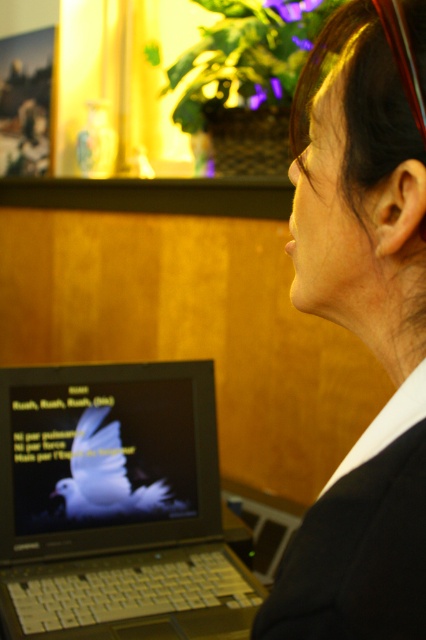
You are a tailor who needs to place a white matte bird at center onto the black fabric business suit at lower right. Given the distance between them is 29.07 inches, can you determine if the bird will fit on the suit without overlapping?

The white matte bird at center and black fabric business suit at lower right are 29.07 inches apart. Since the distance between them is greater than the bird and suit dimensions, the bird can be placed on the suit without overlapping.

You are a delivery person who needs to place a small package on the desk in the image. The package must be placed exactly at the point labeled point (316, 288). However, you can only place it within 18.29 inches of the edge of the desk. Can you place the package at the specified point?

The distance between them is 18.29 inches, so yes, the package can be placed at point (316, 288) since it is within the 18.29 inch limit from the edge of the desk.

You are an interior designer planning to place a new decorative item on the desk. The desk has limited space. Given that the matte black laptop at center is taller than the white matte bird at center, which object would you recommend removing to make space for a taller item?

Since the matte black laptop at center is taller than the white matte bird at center, removing the white matte bird at center would free up vertical space for a taller item.